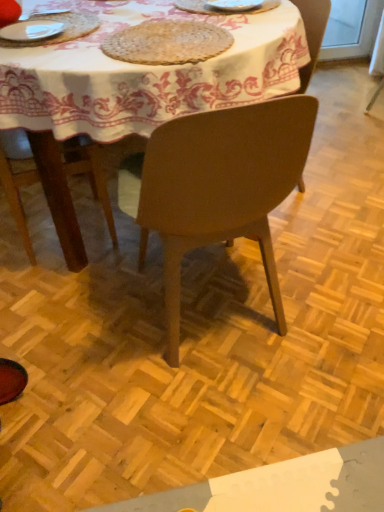
Question: Considering the positions of white ceramic plate at upper center and white fabric tablecloth at center in the image, is white ceramic plate at upper center bigger or smaller than white fabric tablecloth at center?

Choices:
 (A) small
 (B) big

Answer: (A)

Question: Choose the correct answer: Is white ceramic plate at upper center inside white fabric tablecloth at center or outside it?

Choices:
 (A) inside
 (B) outside

Answer: (A)

Question: Based on their relative distances, which object is farther from the white glossy plate at upper left?

Choices:
 (A) matte brown chair at center, the second chair from the front
 (B) matte brown chair at center, marked as the first chair in a front-to-back arrangement
 (C) white fabric tablecloth at center
 (D) white ceramic plate at upper center
 (E) woven natural fiber mat at upper center

Answer: (A)

Question: Which object is positioned closest to the matte brown chair at center, which ranks as the 2th chair in back-to-front order?

Choices:
 (A) woven natural fiber mat at upper center
 (B) white fabric tablecloth at center
 (C) white ceramic plate at upper center
 (D) white glossy plate at upper left
 (E) matte brown chair at center, which ranks as the 1th chair in back-to-front order

Answer: (B)